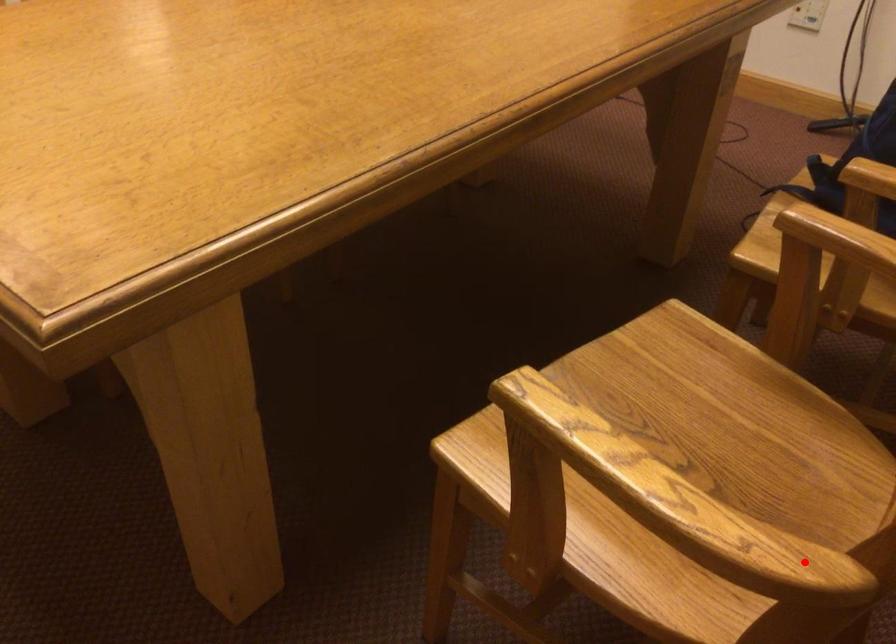
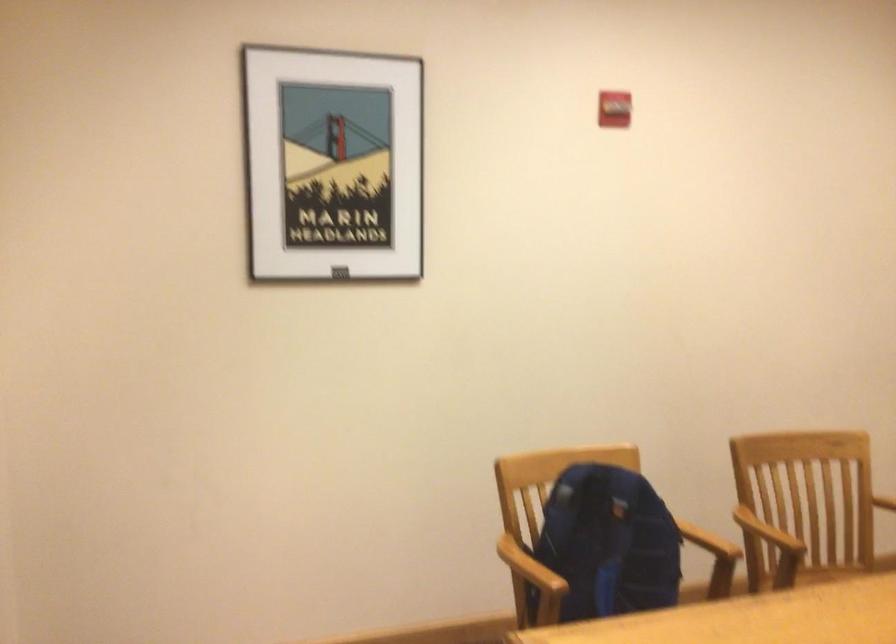
Question: I am providing you with two images of the same scene from different viewpoints. Given a red point in image1, look at the same physical point in image2. Is it:

Choices:
 (A) Closer to the viewpoint
 (B) Farther from the viewpoint

Answer: (B)